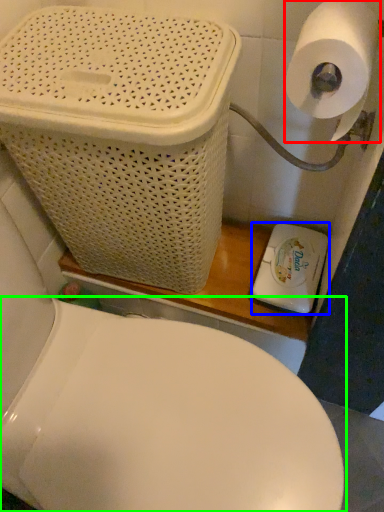
Question: Based on their relative distances, which object is farther from toilet paper (highlighted by a red box)? Choose from appliance (highlighted by a blue box) and toilet (highlighted by a green box).

Choices:
 (A) appliance
 (B) toilet

Answer: (B)